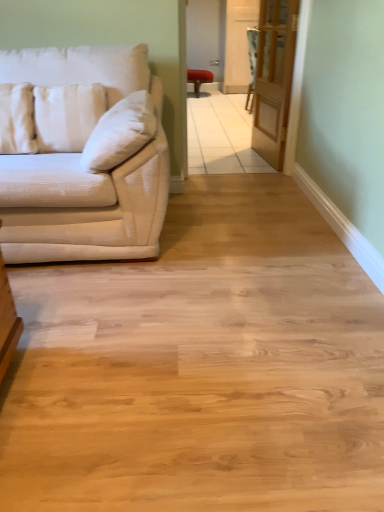
The height and width of the screenshot is (512, 384). I want to click on free location in front of matte white couch at left, so click(109, 329).